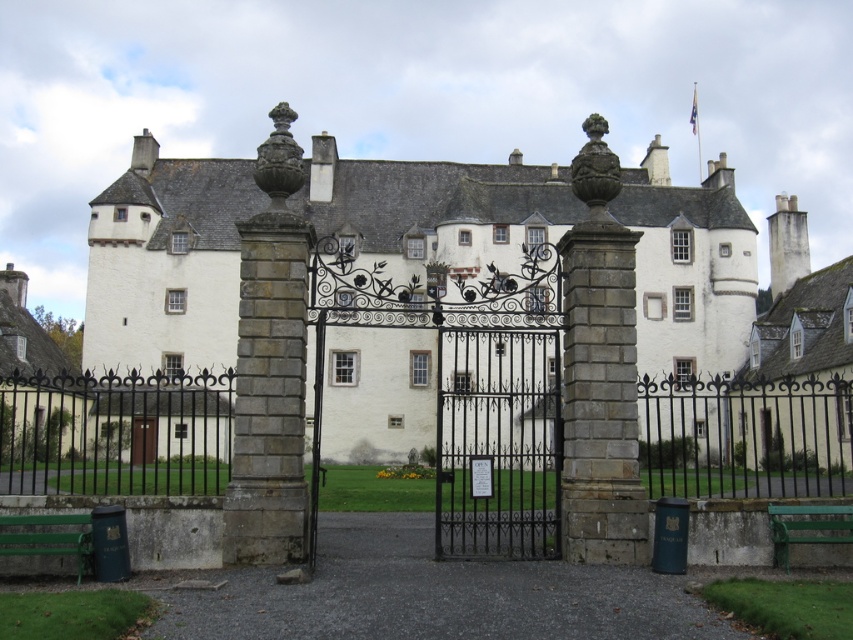
Is green painted wood park bench at lower right bigger than brown wooden door at center?

No.

Does green painted wood park bench at lower right have a greater width compared to brown wooden door at center?

No, green painted wood park bench at lower right is not wider than brown wooden door at center.

The height and width of the screenshot is (640, 853). What do you see at coordinates (807, 525) in the screenshot? I see `green painted wood park bench at lower right` at bounding box center [807, 525].

Where is `green painted wood park bench at lower right`? The height and width of the screenshot is (640, 853). green painted wood park bench at lower right is located at coordinates (807, 525).

Which of these two, green wooden bench at lower left or brown wooden door at center, stands shorter?

Standing shorter between the two is green wooden bench at lower left.

Is green wooden bench at lower left bigger than brown wooden door at center?

No.

Does point (10, 548) come closer to viewer compared to point (140, 465)?

Yes, point (10, 548) is closer to viewer.

Where is `green wooden bench at lower left`? This screenshot has height=640, width=853. green wooden bench at lower left is located at coordinates (48, 538).

Measure the distance between green wooden bench at lower left and green painted wood park bench at lower right.

They are 25.29 meters apart.

Is green wooden bench at lower left positioned at the back of green painted wood park bench at lower right?

No, green wooden bench at lower left is closer to the viewer.

Does point (86, 525) come behind point (834, 504)?

No, it is not.

Image resolution: width=853 pixels, height=640 pixels. In order to click on green wooden bench at lower left in this screenshot , I will do `click(48, 538)`.